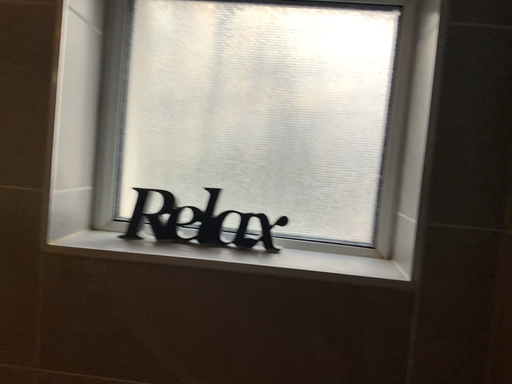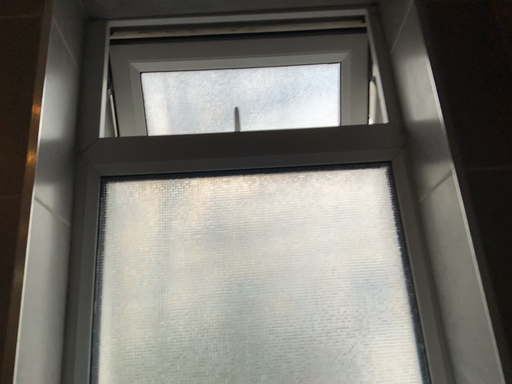
Question: Which way did the camera rotate in the video?

Choices:
 (A) rotated left
 (B) rotated right

Answer: (B)